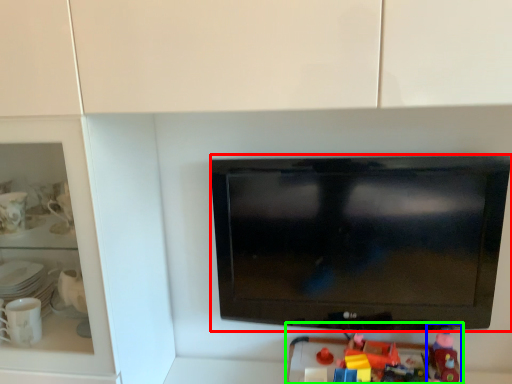
Question: Which is farther away from television (highlighted by a red box)? toy (highlighted by a blue box) or toy (highlighted by a green box)?

Choices:
 (A) toy
 (B) toy

Answer: (A)